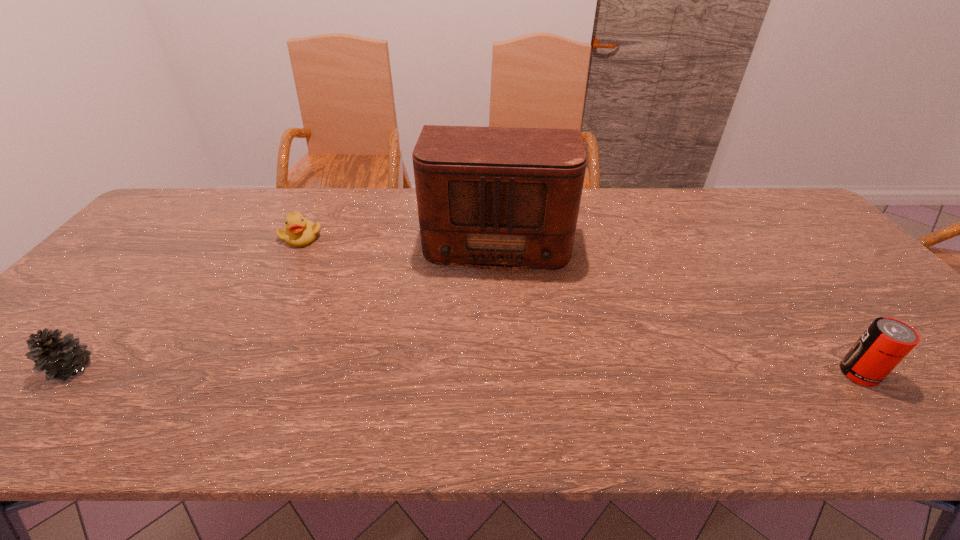
Where is `the leftmost object`? The width and height of the screenshot is (960, 540). the leftmost object is located at coordinates (60, 358).

The width and height of the screenshot is (960, 540). Find the location of `pinecone`. pinecone is located at coordinates (60, 358).

The height and width of the screenshot is (540, 960). What are the coordinates of `the third shortest object` in the screenshot? It's located at (887, 341).

Identify the location of can. (x=887, y=341).

This screenshot has width=960, height=540. Find the location of `the second object from right to left`. the second object from right to left is located at coordinates (501, 198).

Locate an element on the screen. Image resolution: width=960 pixels, height=540 pixels. the tallest object is located at coordinates (501, 198).

The width and height of the screenshot is (960, 540). Find the location of `the shortest object`. the shortest object is located at coordinates coord(299,232).

The width and height of the screenshot is (960, 540). Find the location of `duckling`. duckling is located at coordinates (299, 232).

Where is `free region located 0.160m on the back of the pinecone`? Image resolution: width=960 pixels, height=540 pixels. free region located 0.160m on the back of the pinecone is located at coordinates (129, 303).

The height and width of the screenshot is (540, 960). I want to click on free space located 0.050m on the left of the rightmost object, so click(x=819, y=374).